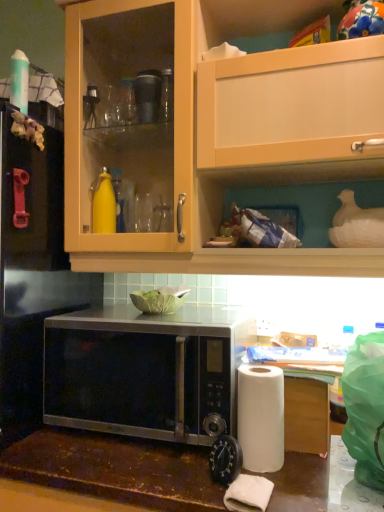
Question: Could you tell me if black metallic microwave at center is facing white matte paper towel at lower right?

Choices:
 (A) yes
 (B) no

Answer: (B)

Question: Does black metallic microwave at center come in front of white matte paper towel at lower right?

Choices:
 (A) yes
 (B) no

Answer: (B)

Question: Does black metallic microwave at center have a lesser width compared to white matte paper towel at lower right?

Choices:
 (A) yes
 (B) no

Answer: (B)

Question: From a real-world perspective, is black metallic microwave at center positioned over white matte paper towel at lower right based on gravity?

Choices:
 (A) no
 (B) yes

Answer: (B)

Question: Can you confirm if black metallic microwave at center is taller than white matte paper towel at lower right?

Choices:
 (A) no
 (B) yes

Answer: (B)

Question: From a real-world perspective, relative to black matte microwave at lower center, is black metallic microwave at center vertically above or below?

Choices:
 (A) above
 (B) below

Answer: (B)

Question: Is black metallic microwave at center to the left or to the right of black matte microwave at lower center in the image?

Choices:
 (A) left
 (B) right

Answer: (B)

Question: Is black metallic microwave at center in front of or behind black matte microwave at lower center in the image?

Choices:
 (A) behind
 (B) front

Answer: (B)

Question: Considering the positions of black metallic microwave at center and black matte microwave at lower center in the image, is black metallic microwave at center wider or thinner than black matte microwave at lower center?

Choices:
 (A) thin
 (B) wide

Answer: (A)

Question: Is matte wood cabinet at upper center wider or thinner than white paper at lower right?

Choices:
 (A) thin
 (B) wide

Answer: (B)

Question: Is matte wood cabinet at upper center taller or shorter than white paper at lower right?

Choices:
 (A) tall
 (B) short

Answer: (A)

Question: Visually, is matte wood cabinet at upper center positioned to the left or to the right of white paper at lower right?

Choices:
 (A) right
 (B) left

Answer: (B)

Question: From a real-world perspective, is matte wood cabinet at upper center above or below white paper at lower right?

Choices:
 (A) above
 (B) below

Answer: (A)

Question: Based on their sizes in the image, would you say matte wood cabinet at upper center is bigger or smaller than black metallic microwave at center?

Choices:
 (A) small
 (B) big

Answer: (B)

Question: Considering the positions of point (76, 10) and point (190, 352), is point (76, 10) closer or farther from the camera than point (190, 352)?

Choices:
 (A) closer
 (B) farther

Answer: (B)